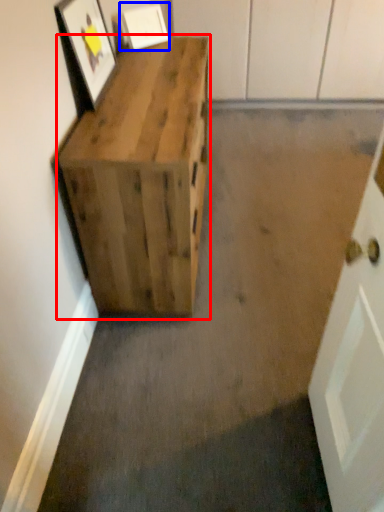
Question: Among these objects, which one is farthest to the camera, furniture (highlighted by a red box) or picture frame (highlighted by a blue box)?

Choices:
 (A) furniture
 (B) picture frame

Answer: (B)